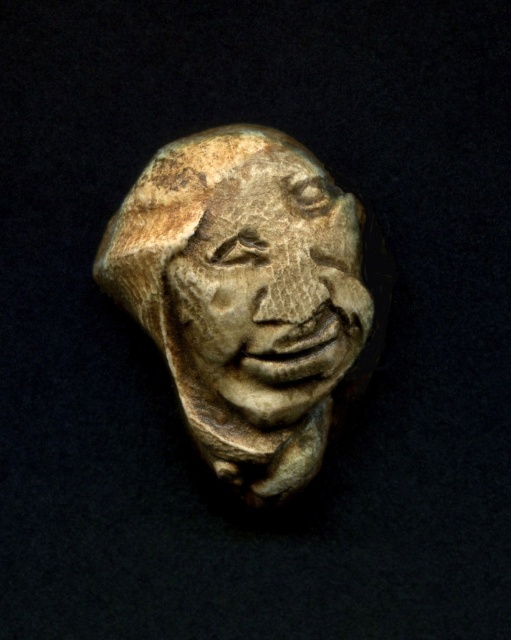
You are an archaeologist examining the image of an ancient sculpture. The coordinates given are in a normalized system where the bottom left corner is the origin. Where is the matte stone head at center located in terms of its coordinates?

The matte stone head at center is located at coordinates point (251, 298).

What is located at the coordinates point (x=251, y=298) in the image?

The point (x=251, y=298) corresponds to the location of the matte stone head at center.

You are an archaeologist examining two stone artifacts in the image. You notice that the matte stone head at center and the carved stone face at center are arranged in a particular way. Which one is located to the left of the other?

The matte stone head at center is positioned on the left side of carved stone face at center, so the matte stone head at center is to the left of the carved stone face at center.